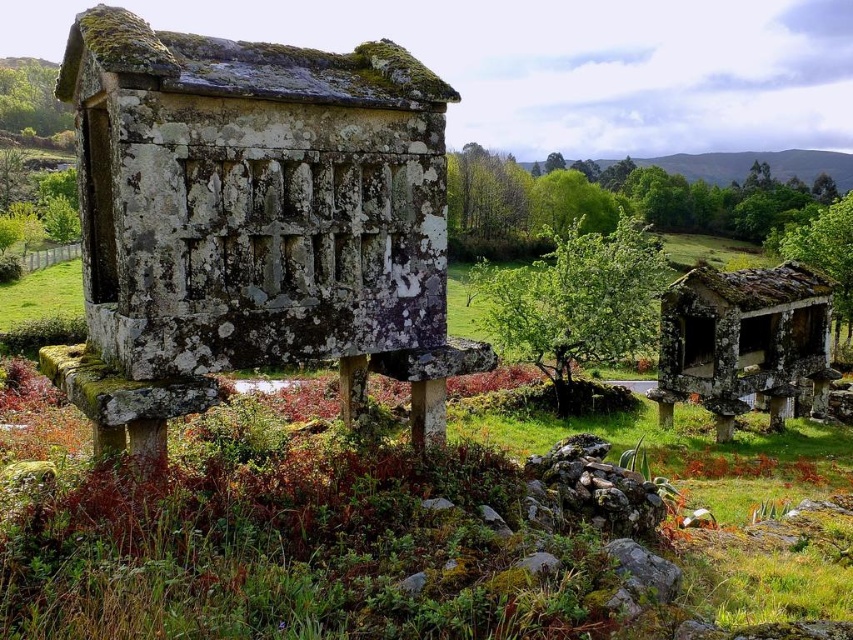
Question: Does speckled stone hut at center appear under rusty metal hut at right?

Choices:
 (A) no
 (B) yes

Answer: (A)

Question: Does speckled stone hut at center appear under green leafy bush at center?

Choices:
 (A) yes
 (B) no

Answer: (A)

Question: Does speckled stone hut at center have a smaller size compared to green leafy bush at center?

Choices:
 (A) yes
 (B) no

Answer: (A)

Question: Which point is farther to the camera?

Choices:
 (A) rusty metal hut at right
 (B) green leafy bush at center

Answer: (B)

Question: Among these points, which one is nearest to the camera?

Choices:
 (A) (751, 268)
 (B) (560, 371)
 (C) (323, 314)

Answer: (C)

Question: Which is nearer to the rusty metal hut at right?

Choices:
 (A) speckled stone hut at center
 (B) green leafy bush at center

Answer: (B)